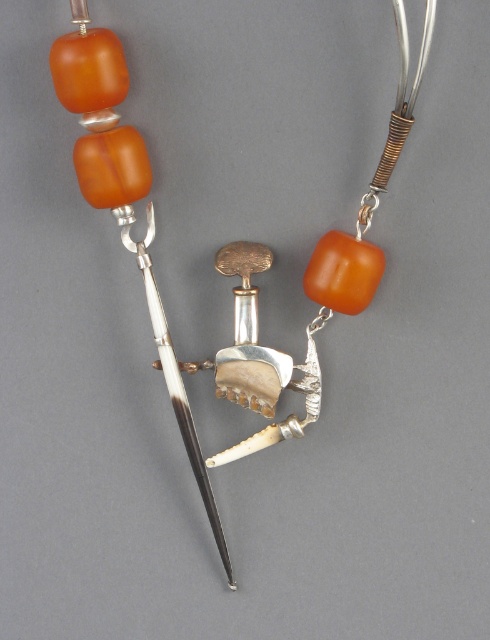
You are examining the necklace and want to know which of the two matte orange beads is nearer to you. The beads are the matte orange glass beads at upper center and the matte orange bead at upper left. Can you determine which one is closer?

The matte orange glass beads at upper center is closer to the viewer than the matte orange bead at upper left.

Where are the matte orange glass beads at upper center located in the image?

The matte orange glass beads at upper center are located at point coordinates of 0.383 on the x axis and 0.461 on the y axis.